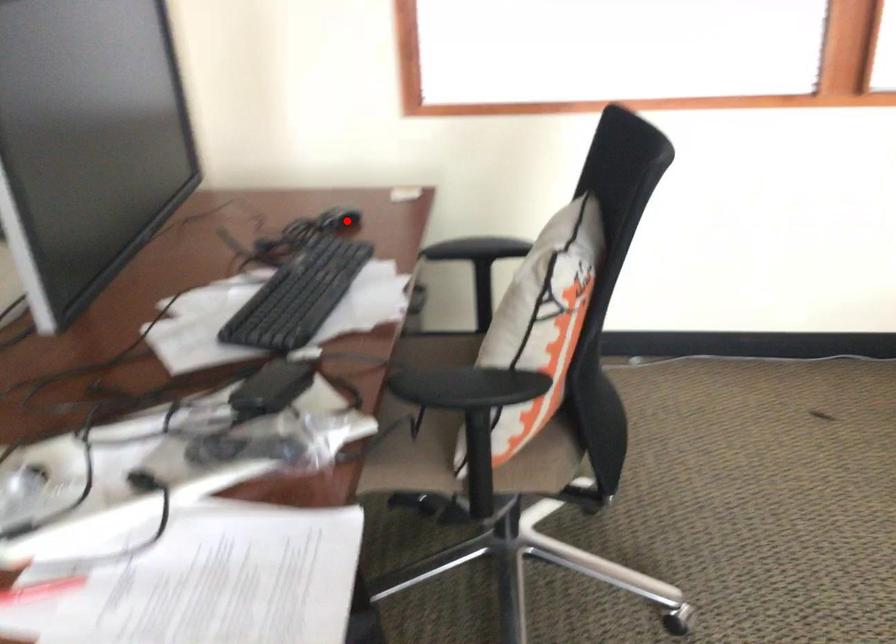
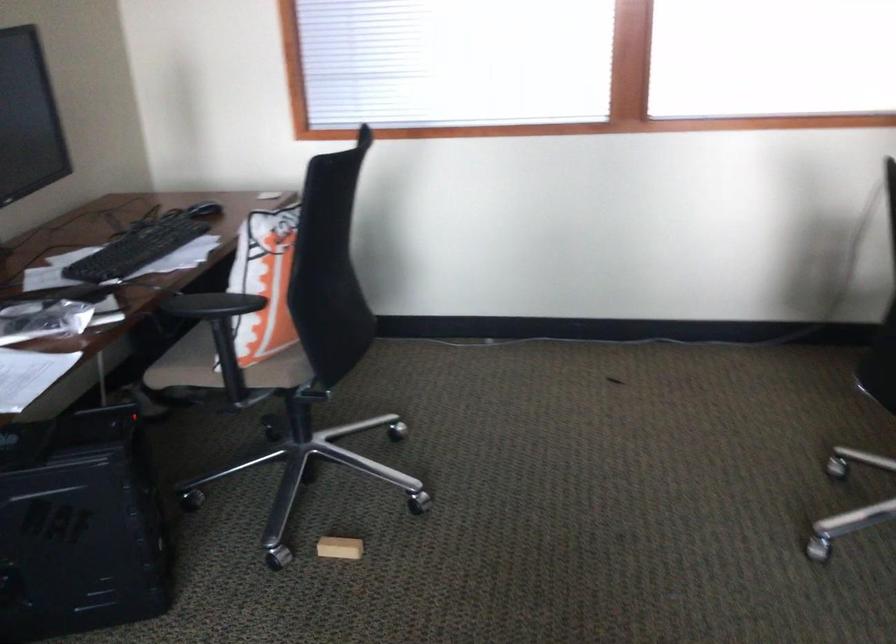
Question: I am providing you with two images of the same scene from different viewpoints. In image1, a red point is highlighted. Considering the same 3D point in image2, which of the following is correct?

Choices:
 (A) It is closer
 (B) It is farther

Answer: (B)